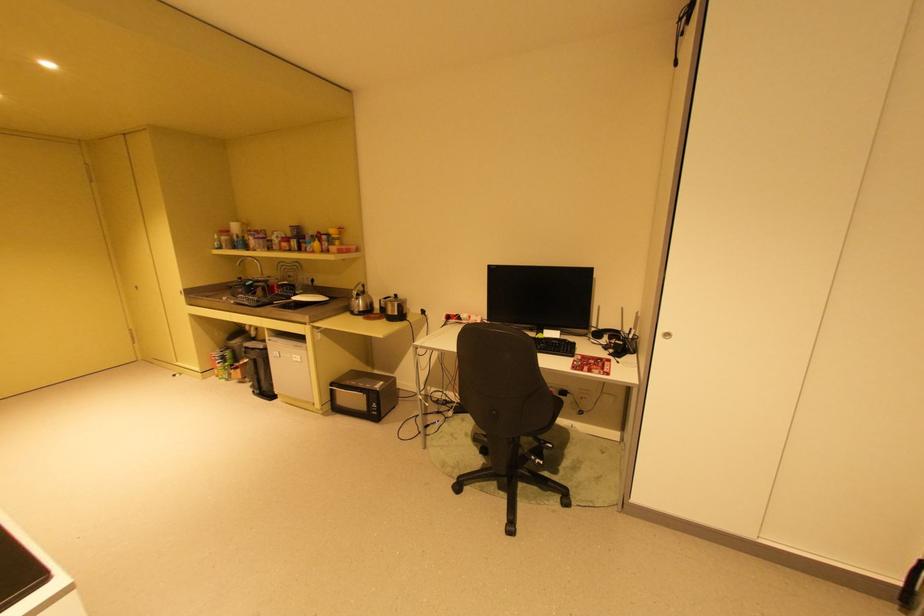
Locate an element on the screen. The height and width of the screenshot is (616, 924). chair sitting surface is located at coordinates (546, 415).